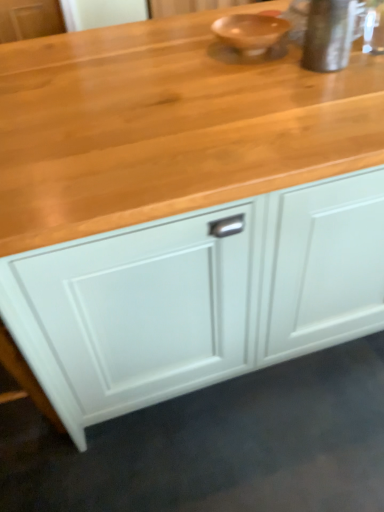
What do you see at coordinates (197, 296) in the screenshot? I see `matte white cabinet at center` at bounding box center [197, 296].

I want to click on matte white cabinet at center, so click(197, 296).

I want to click on matte white cabinet at center, so click(197, 296).